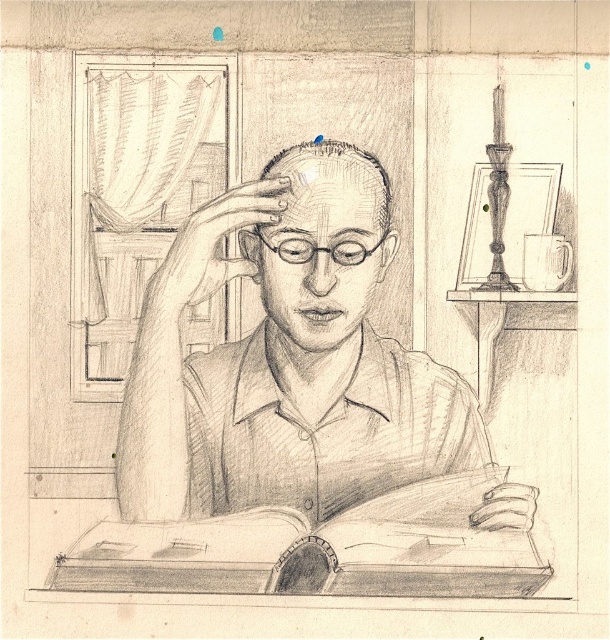
Question: Is pencil-drawn man at center below smooth skin head at center?

Choices:
 (A) no
 (B) yes

Answer: (B)

Question: Does pencil-drawn man at center have a lesser width compared to white ceramic mug at upper right?

Choices:
 (A) no
 (B) yes

Answer: (A)

Question: Which is nearer to the pencil-drawn man at center?

Choices:
 (A) white ceramic mug at upper right
 (B) smooth paper book at center

Answer: (B)

Question: Considering the relative positions of smooth paper book at center and white ceramic mug at upper right in the image provided, where is smooth paper book at center located with respect to white ceramic mug at upper right?

Choices:
 (A) left
 (B) right

Answer: (A)

Question: Estimate the real-world distances between objects in this image. Which object is closer to the smooth skin head at center?

Choices:
 (A) white ceramic mug at upper right
 (B) smooth paper book at center
 (C) pencil-drawn man at center

Answer: (C)

Question: Based on their relative distances, which object is farther from the pencil-drawn man at center?

Choices:
 (A) white ceramic mug at upper right
 (B) smooth skin head at center

Answer: (A)